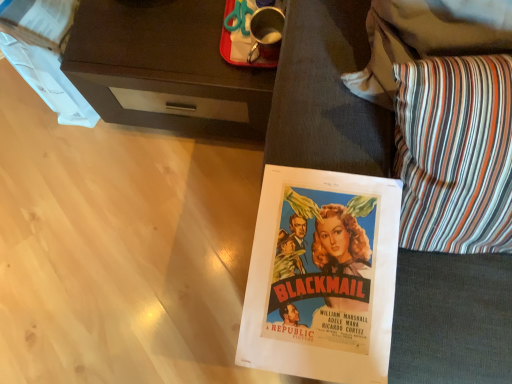
This screenshot has width=512, height=384. Describe the element at coordinates (455, 154) in the screenshot. I see `striped fabric pillow at lower right` at that location.

The width and height of the screenshot is (512, 384). What are the coordinates of `striped fabric pillow at lower right` in the screenshot? It's located at (455, 154).

In order to face striped fabric pillow at lower right, should I rotate leftwards or rightwards?

You should rotate right by 30.039 degrees.

Describe the element at coordinates (166, 69) in the screenshot. I see `dark wood desk at upper left` at that location.

Where is `dark wood desk at upper left`? This screenshot has width=512, height=384. dark wood desk at upper left is located at coordinates (166, 69).

In order to face dark wood desk at upper left, should I rotate leftwards or rightwards?

To align with it, rotate left about 8.248°.

Identify the location of striped fabric pillow at lower right. (455, 154).

Considering the positions of objects striped fabric pillow at lower right and dark wood desk at upper left in the image provided, who is more to the left, striped fabric pillow at lower right or dark wood desk at upper left?

dark wood desk at upper left.

Who is more distant, striped fabric pillow at lower right or dark wood desk at upper left?

dark wood desk at upper left is further from the camera.

Which point is more forward, (455, 64) or (139, 30)?

The point (455, 64) is closer to the camera.

In the scene shown: From the image's perspective, between striped fabric pillow at lower right and dark wood desk at upper left, who is located below?

From the image's view, striped fabric pillow at lower right is below.

From a real-world perspective, who is located lower, striped fabric pillow at lower right or dark wood desk at upper left?

dark wood desk at upper left is physically lower.

Looking at their sizes, would you say striped fabric pillow at lower right is wider or thinner than dark wood desk at upper left?

striped fabric pillow at lower right is thinner than dark wood desk at upper left.

Is striped fabric pillow at lower right taller or shorter than dark wood desk at upper left?

Considering their sizes, striped fabric pillow at lower right has less height than dark wood desk at upper left.

Which of these two, striped fabric pillow at lower right or dark wood desk at upper left, is bigger?

dark wood desk at upper left is bigger.

Is striped fabric pillow at lower right positioned beyond the bounds of dark wood desk at upper left?

striped fabric pillow at lower right is positioned outside dark wood desk at upper left.

Is striped fabric pillow at lower right not close to dark wood desk at upper left?

striped fabric pillow at lower right is actually quite close to dark wood desk at upper left.

Does striped fabric pillow at lower right turn towards dark wood desk at upper left?

No, striped fabric pillow at lower right is not aimed at dark wood desk at upper left.

Measure the distance from striped fabric pillow at lower right to dark wood desk at upper left.

striped fabric pillow at lower right is 23.11 inches from dark wood desk at upper left.

You are a GUI agent. You are given a task and a screenshot of the screen. Output one action in this format:
    pyautogui.click(x=<x>, y=<y>)
    Task: Click on the desk that appears on the left of striped fabric pillow at lower right
    The image size is (512, 384).
    Given the screenshot: What is the action you would take?
    pyautogui.click(x=166, y=69)

In the image, is dark wood desk at upper left on the left side or the right side of striped fabric pillow at lower right?

In the image, dark wood desk at upper left appears on the left side of striped fabric pillow at lower right.

Between dark wood desk at upper left and striped fabric pillow at lower right, which one is positioned behind?

dark wood desk at upper left is behind.

Considering the points (214, 52) and (510, 123), which point is in front, point (214, 52) or point (510, 123)?

The point (510, 123) is in front.

From the image's perspective, is dark wood desk at upper left on top of striped fabric pillow at lower right?

Indeed, from the image's perspective, dark wood desk at upper left is shown above striped fabric pillow at lower right.

From a real-world perspective, is dark wood desk at upper left on top of striped fabric pillow at lower right?

No, from a real-world perspective, dark wood desk at upper left is not on top of striped fabric pillow at lower right.

Is dark wood desk at upper left thinner than striped fabric pillow at lower right?

Incorrect, the width of dark wood desk at upper left is not less than that of striped fabric pillow at lower right.

Based on the photo, considering the relative sizes of dark wood desk at upper left and striped fabric pillow at lower right in the image provided, is dark wood desk at upper left shorter than striped fabric pillow at lower right?

In fact, dark wood desk at upper left may be taller than striped fabric pillow at lower right.

Is dark wood desk at upper left bigger or smaller than striped fabric pillow at lower right?

Considering their sizes, dark wood desk at upper left takes up more space than striped fabric pillow at lower right.

Would you say striped fabric pillow at lower right is part of dark wood desk at upper left's contents?

No, striped fabric pillow at lower right is located outside of dark wood desk at upper left.

Are dark wood desk at upper left and striped fabric pillow at lower right far apart?

dark wood desk at upper left is near striped fabric pillow at lower right, not far away.

Does dark wood desk at upper left turn towards striped fabric pillow at lower right?

No, dark wood desk at upper left is not aimed at striped fabric pillow at lower right.

Measure the distance between dark wood desk at upper left and striped fabric pillow at lower right.

dark wood desk at upper left and striped fabric pillow at lower right are 23.11 inches apart from each other.

Locate an element on the screen. Image resolution: width=512 pixels, height=384 pixels. throw pillow that appears above the dark wood desk at upper left (from a real-world perspective) is located at coordinates (455, 154).

Locate an element on the screen. The image size is (512, 384). desk on the left of striped fabric pillow at lower right is located at coordinates (166, 69).

Locate an element on the screen. The width and height of the screenshot is (512, 384). throw pillow positioned vertically above the dark wood desk at upper left (from a real-world perspective) is located at coordinates (455, 154).